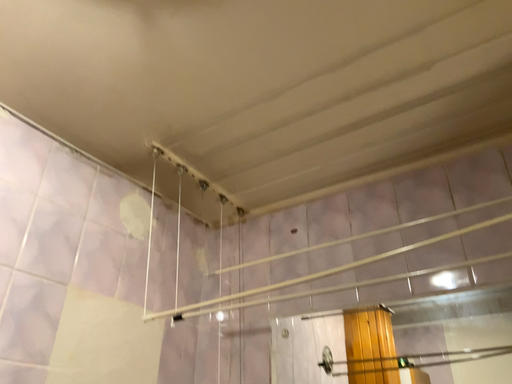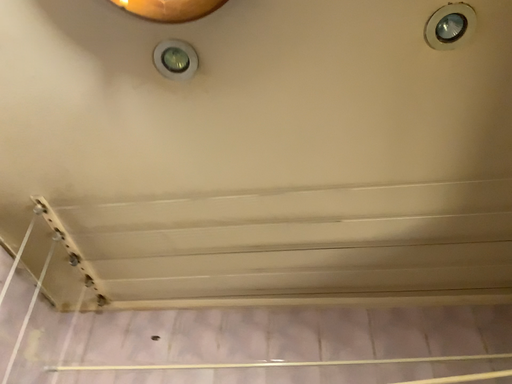
Question: Which way did the camera rotate in the video?

Choices:
 (A) rotated left
 (B) rotated right

Answer: (B)